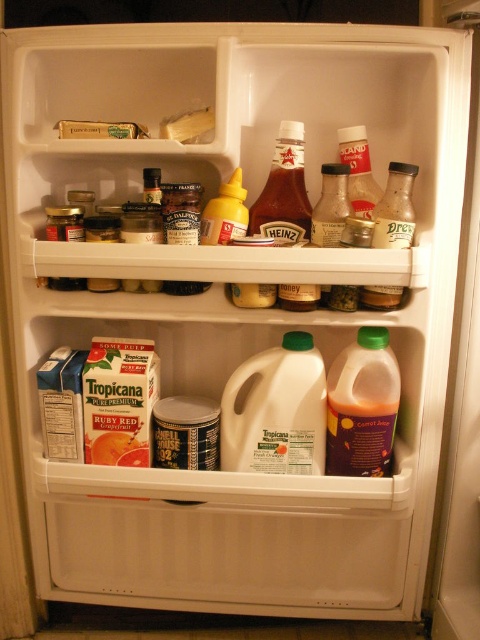
Is translucent plastic dressing bottle at upper right smaller than yellow glossy mustard at upper center?

Actually, translucent plastic dressing bottle at upper right might be larger than yellow glossy mustard at upper center.

Which is more to the right, translucent plastic dressing bottle at upper right or yellow glossy mustard at upper center?

Positioned to the right is translucent plastic dressing bottle at upper right.

Which is behind, point (372, 300) or point (208, 241)?

Point (208, 241)

Where is `translucent plastic dressing bottle at upper right`? translucent plastic dressing bottle at upper right is located at coordinates (396, 209).

Based on the photo, between white plastic jug at center and translucent plastic dressing bottle at upper right, which one appears on the right side from the viewer's perspective?

From the viewer's perspective, translucent plastic dressing bottle at upper right appears more on the right side.

Which is behind, point (310, 445) or point (406, 212)?

Positioned behind is point (310, 445).

The width and height of the screenshot is (480, 640). In order to click on white plastic jug at center in this screenshot , I will do `click(276, 412)`.

Which is more to the right, white plastic jug at center or translucent plastic carrot juice at lower center?

translucent plastic carrot juice at lower center is more to the right.

What do you see at coordinates (276, 412) in the screenshot?
I see `white plastic jug at center` at bounding box center [276, 412].

Who is more distant from viewer, (288, 435) or (369, 360)?

The point (288, 435) is more distant.

At what (x,y) coordinates should I click in order to perform the action: click on white plastic jug at center. Please return your answer as a coordinate pair (x, y). Looking at the image, I should click on (276, 412).